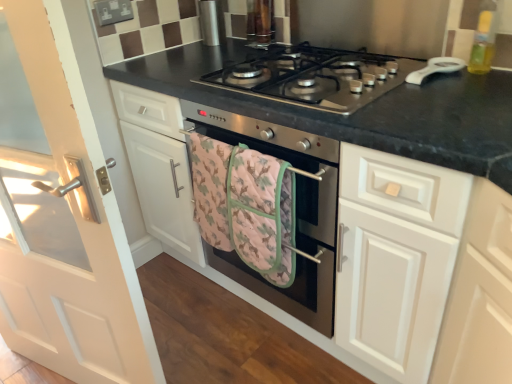
You are a GUI agent. You are given a task and a screenshot of the screen. Output one action in this format:
    pyautogui.click(x=<x>, y=<y>)
    Task: Click on the blank space above stainless steel gas stove at center (from a real-world perspective)
    Image resolution: width=512 pixels, height=384 pixels.
    Given the screenshot: What is the action you would take?
    pyautogui.click(x=292, y=65)